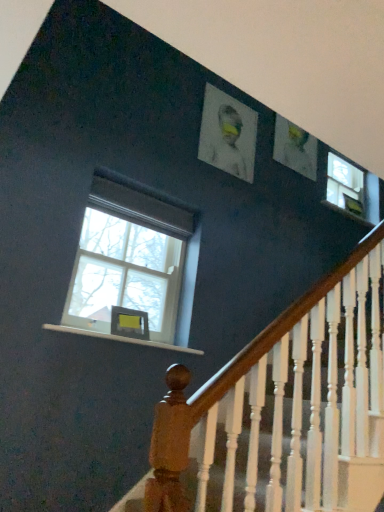
Question: In terms of size, does white matte portrait at upper center appear bigger or smaller than clear glass window at left?

Choices:
 (A) big
 (B) small

Answer: (B)

Question: From the image's perspective, is white matte portrait at upper center positioned above or below clear glass window at left?

Choices:
 (A) above
 (B) below

Answer: (A)

Question: Estimate the real-world distances between objects in this image. Which object is closer to the white matte portrait at upper center?

Choices:
 (A) white wood at lower left
 (B) clear glass window at left

Answer: (B)

Question: Which of these objects is positioned closest to the white wood at lower left?

Choices:
 (A) clear glass window at left
 (B) white matte portrait at upper center

Answer: (A)